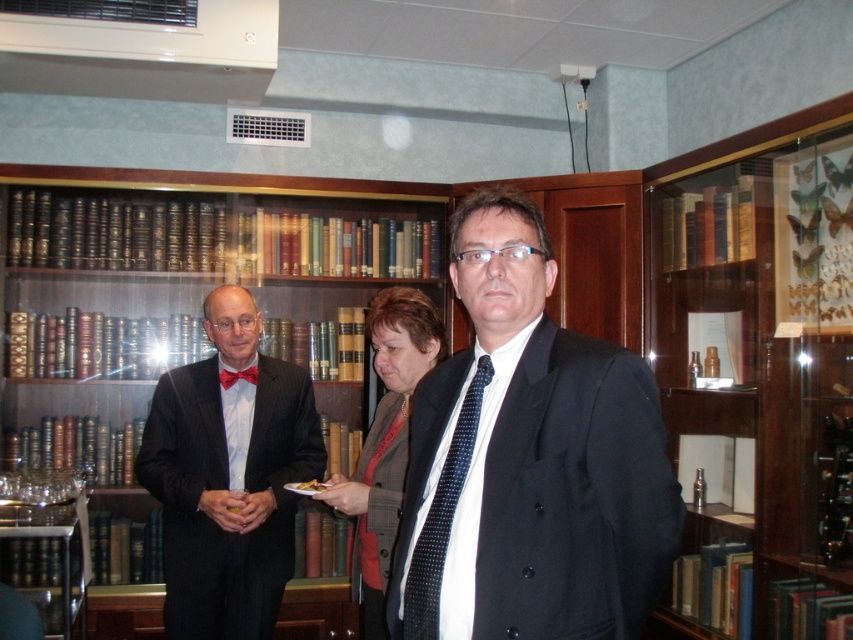
Does black dotted tie at center come behind matte red bow tie at center?

No, black dotted tie at center is closer to the viewer.

Is black dotted tie at center taller than matte red bow tie at center?

Yes, black dotted tie at center is taller than matte red bow tie at center.

Identify the location of black dotted tie at center. (442, 516).

Is the position of matte black suit at center more distant than that of black dotted tie at center?

No, matte black suit at center is in front of black dotted tie at center.

Which is more to the left, matte black suit at center or black dotted tie at center?

black dotted tie at center is more to the left.

Does point (590, 572) come farther from viewer compared to point (424, 572)?

That is False.

Find the location of a particular element. This screenshot has width=853, height=640. matte black suit at center is located at coordinates (529, 460).

Does wooden bookshelf at upper right lie behind black dotted tie at center?

Yes, it is.

Who is positioned more to the right, wooden bookshelf at upper right or black dotted tie at center?

wooden bookshelf at upper right

Looking at this image, who is more distant from viewer, (x=817, y=582) or (x=479, y=410)?

The point (x=817, y=582) is behind.

The height and width of the screenshot is (640, 853). Find the location of `wooden bookshelf at upper right`. wooden bookshelf at upper right is located at coordinates (758, 372).